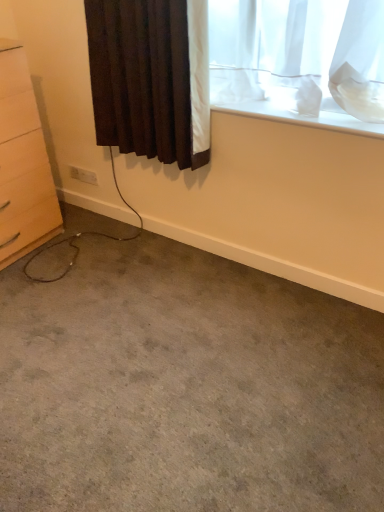
Question: In the image, is light wood chest of drawers at left on the left side or the right side of brown textured curtain at upper left?

Choices:
 (A) right
 (B) left

Answer: (B)

Question: Which is correct: light wood chest of drawers at left is inside brown textured curtain at upper left, or outside of it?

Choices:
 (A) outside
 (B) inside

Answer: (A)

Question: Estimate the real-world distances between objects in this image. Which object is closer to the gray carpet at lower center?

Choices:
 (A) white matte window sill at upper right
 (B) brown textured curtain at upper left
 (C) light wood chest of drawers at left
 (D) white plastic electric outlet at lower left

Answer: (C)

Question: Considering the real-world distances, which object is closest to the brown textured curtain at upper left?

Choices:
 (A) light wood chest of drawers at left
 (B) white matte window sill at upper right
 (C) white plastic electric outlet at lower left
 (D) gray carpet at lower center

Answer: (B)